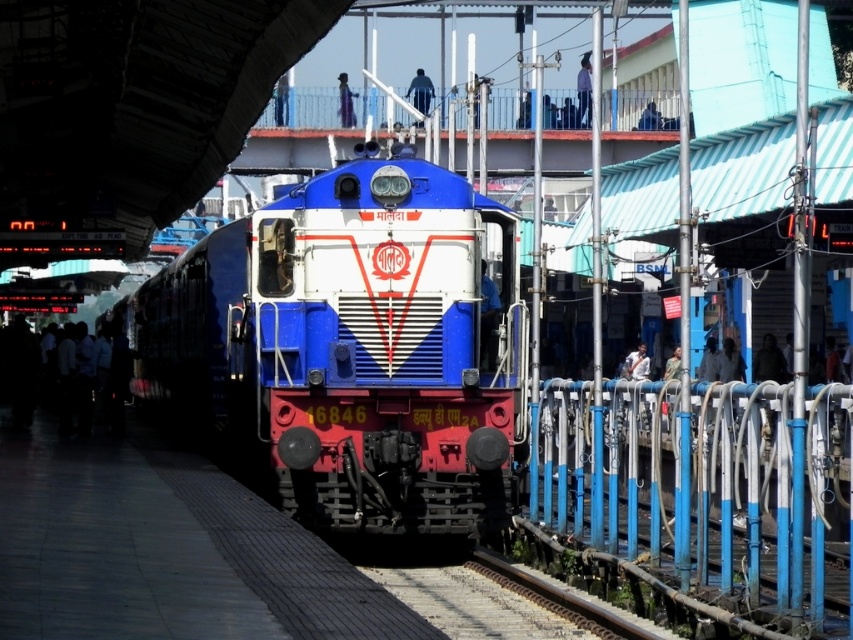
You are a passenger standing on the platform and want to board the train. There are two people in front of you blocking the way. One is wearing blue fabric pants at center and the other is wearing dark blue uniform at upper center. Which person has wider clothing from the waist down?

The blue fabric pants at center has a larger width than the dark blue uniform at upper center, so the person wearing blue fabric pants at center has wider clothing from the waist down.

You are a photographer standing at the railway station. You want to take a photo of the blue painted metal pole at right and the blue fabric pants at center. Which object should you zoom in more on to capture details of both objects in the frame?

Since the blue painted metal pole at right is larger in size compared to the blue fabric pants at center, you should zoom in more on the blue fabric pants at center to ensure both objects are visible and balanced in the frame.

You are a passenger at the station and want to identify the larger item between the blue fabric pants at center and the dark blue uniform at upper center. Which one is larger?

The blue fabric pants at center is bigger than the dark blue uniform at upper center.